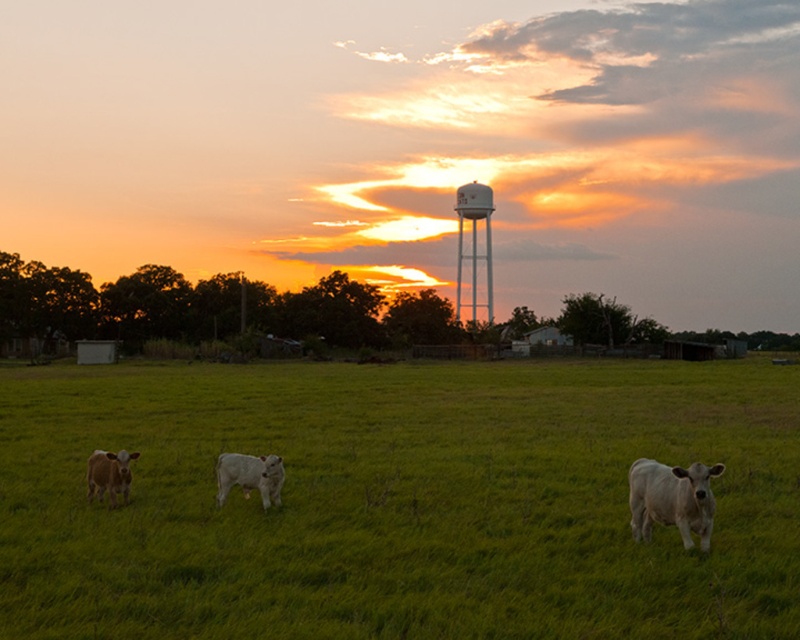
Does white smooth cow at lower right lie in front of white matte water tower at upper center?

Yes.

Which is more to the left, white smooth cow at lower right or white matte water tower at upper center?

Positioned to the left is white smooth cow at lower right.

Identify the location of white smooth cow at lower right. Image resolution: width=800 pixels, height=640 pixels. (x=672, y=499).

Which of these two, green grass pasture at center or white matte water tower at upper center, stands taller?

white matte water tower at upper center

Which is behind, point (184, 573) or point (480, 211)?

The point (480, 211) is more distant.

The height and width of the screenshot is (640, 800). Find the location of `green grass pasture at center`. green grass pasture at center is located at coordinates (397, 500).

Does white smooth cow at center have a lesser height compared to white matte water tower at upper center?

Yes.

Does white smooth cow at center have a greater width compared to white matte water tower at upper center?

Incorrect, white smooth cow at center's width does not surpass white matte water tower at upper center's.

The image size is (800, 640). What are the coordinates of `white smooth cow at center` in the screenshot? It's located at (249, 476).